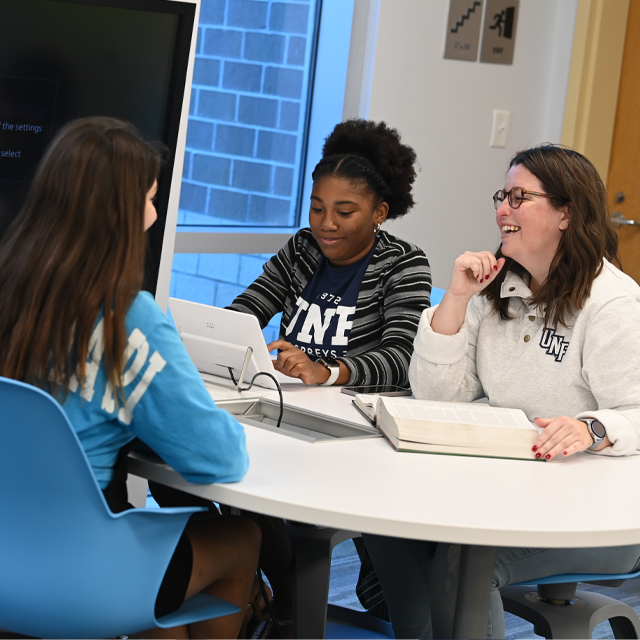
Image resolution: width=640 pixels, height=640 pixels. In order to click on door lock in this screenshot , I will do `click(618, 195)`.